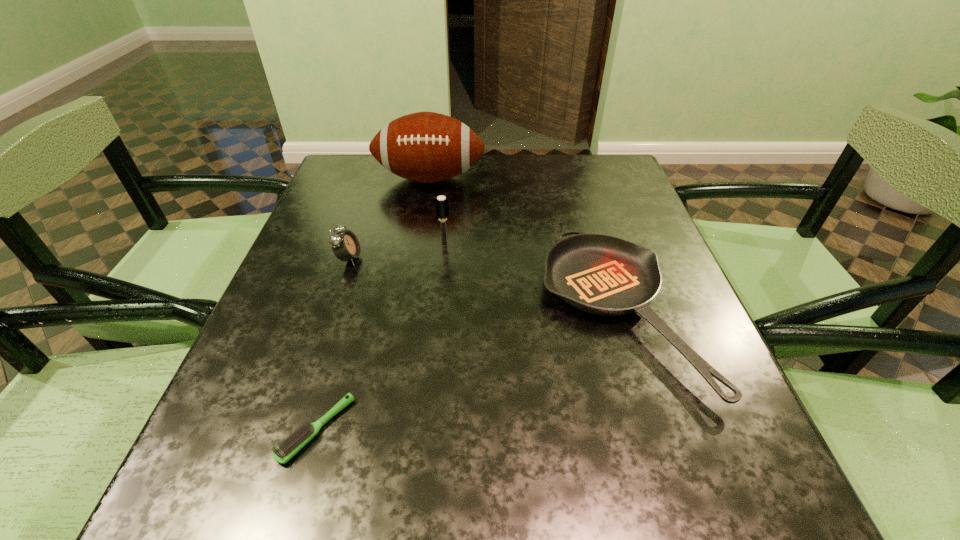
The image size is (960, 540). What are the coordinates of `vacant space in between the shorter hairbrush and the alarm clock` in the screenshot? It's located at (333, 343).

Locate an element on the screen. free space that is in between the left hairbrush and the farthest object is located at coordinates (373, 304).

What are the coordinates of `free space between the alarm clock and the rightmost object` in the screenshot? It's located at (483, 285).

This screenshot has width=960, height=540. Identify the location of vacant space that's between the alarm clock and the fourth tallest object. (483, 285).

The height and width of the screenshot is (540, 960). I want to click on free space between the football and the shortest object, so click(x=373, y=304).

Find the location of `vacant area that lies between the tallest object and the alarm clock`. vacant area that lies between the tallest object and the alarm clock is located at coordinates (390, 218).

Locate an element on the screen. free space that is in between the left hairbrush and the tallest object is located at coordinates (373, 304).

Select which object appears as the third closest to the second shortest object. Please provide its 2D coordinates. Your answer should be formatted as a tuple, i.e. [(x, y)], where the tuple contains the x and y coordinates of a point satisfying the conditions above.

[(297, 440)]

I want to click on object that is the third closest to the fourth tallest object, so click(297, 440).

Find the location of a particular element. free spot that satisfies the following two spatial constraints: 1. on the back side of the rightmost object; 2. on the face of the alarm clock is located at coordinates (600, 258).